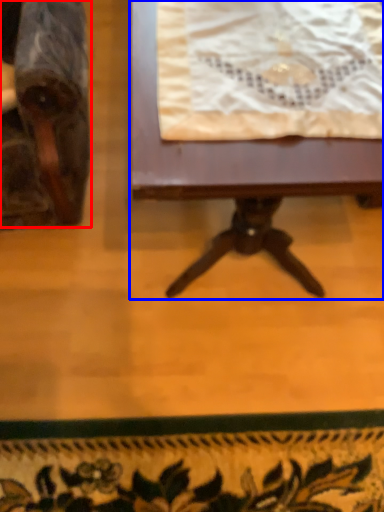
Question: Which object is closer to the camera taking this photo, chair (highlighted by a red box) or table (highlighted by a blue box)?

Choices:
 (A) chair
 (B) table

Answer: (A)